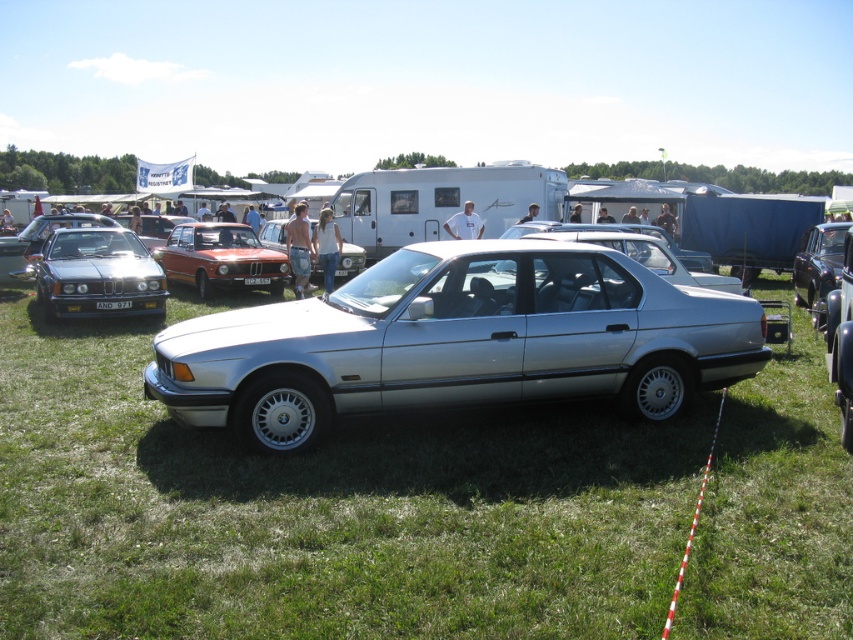
Does silver metallic car at center have a lesser width compared to satin silver car at center?

In fact, silver metallic car at center might be wider than satin silver car at center.

Who is higher up, silver metallic car at center or satin silver car at center?

satin silver car at center is above.

I want to click on silver metallic car at center, so click(x=323, y=509).

In the scene shown: Between shiny silver sedan at left and orange glossy sedan at center, which one has less height?

With less height is shiny silver sedan at left.

I want to click on shiny silver sedan at left, so click(97, 273).

Describe the element at coordinates (97, 273) in the screenshot. The image size is (853, 640). I see `shiny silver sedan at left` at that location.

This screenshot has width=853, height=640. Find the location of `shiny silver sedan at left`. shiny silver sedan at left is located at coordinates (97, 273).

Which is behind, point (817, 225) or point (102, 307)?

The point (817, 225) is more distant.

Which of these two, shiny black sedan at center or white plastic license plate at center, stands shorter?

Standing shorter between the two is white plastic license plate at center.

Is point (822, 234) positioned after point (115, 301)?

Yes, it is behind point (115, 301).

At what (x,y) coordinates should I click in order to perform the action: click on shiny black sedan at center. Please return your answer as a coordinate pair (x, y). This screenshot has width=853, height=640. Looking at the image, I should click on (817, 262).